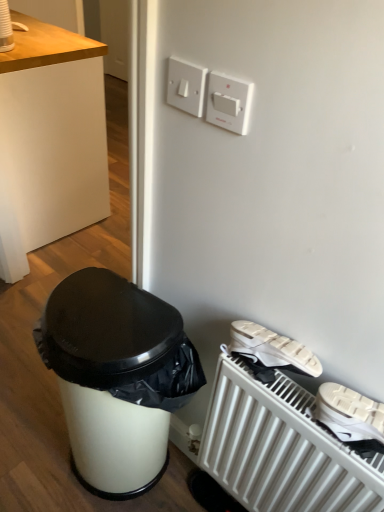
Question: From the image's perspective, is white matte radiator at lower right over white glossy trash can at lower left?

Choices:
 (A) yes
 (B) no

Answer: (A)

Question: Can you confirm if white matte radiator at lower right is shorter than white glossy trash can at lower left?

Choices:
 (A) yes
 (B) no

Answer: (B)

Question: From a real-world perspective, is white matte radiator at lower right located beneath white glossy trash can at lower left?

Choices:
 (A) no
 (B) yes

Answer: (A)

Question: Is the surface of white matte radiator at lower right in direct contact with white glossy trash can at lower left?

Choices:
 (A) no
 (B) yes

Answer: (A)

Question: Can you confirm if white matte radiator at lower right is bigger than white glossy trash can at lower left?

Choices:
 (A) yes
 (B) no

Answer: (A)

Question: Is white matte radiator at lower right positioned behind white glossy trash can at lower left?

Choices:
 (A) yes
 (B) no

Answer: (B)

Question: Is white plastic switch at upper center shorter than white wood desk at upper left?

Choices:
 (A) yes
 (B) no

Answer: (A)

Question: From the image's perspective, is white plastic switch at upper center beneath white wood desk at upper left?

Choices:
 (A) no
 (B) yes

Answer: (B)

Question: Is white plastic switch at upper center positioned far away from white wood desk at upper left?

Choices:
 (A) no
 (B) yes

Answer: (B)

Question: From the image's perspective, is white plastic switch at upper center on white wood desk at upper left?

Choices:
 (A) yes
 (B) no

Answer: (B)

Question: Is white plastic switch at upper center to the left of white wood desk at upper left from the viewer's perspective?

Choices:
 (A) no
 (B) yes

Answer: (A)

Question: Is white wood desk at upper left a part of white plastic switch at upper center?

Choices:
 (A) no
 (B) yes

Answer: (A)

Question: Is white plastic switch at upper center oriented away from white matte radiator at lower right?

Choices:
 (A) no
 (B) yes

Answer: (A)